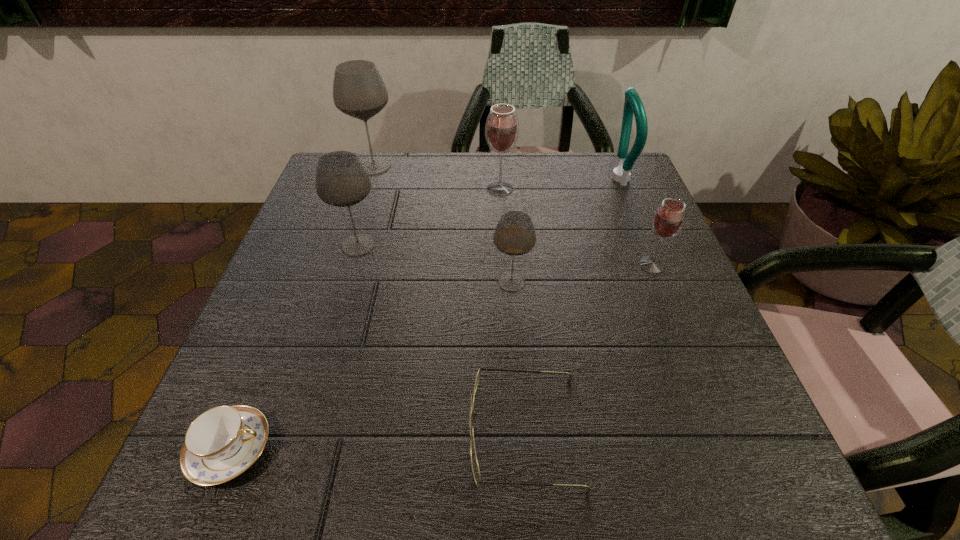
Where is `object positioned at the far left corner`? This screenshot has width=960, height=540. object positioned at the far left corner is located at coordinates (359, 91).

This screenshot has width=960, height=540. Identify the location of object that is positioned at the near left corner. (221, 443).

Identify the location of object that is at the far right corner. This screenshot has height=540, width=960. (633, 104).

Image resolution: width=960 pixels, height=540 pixels. Find the location of `free region at the far edge of the desktop`. free region at the far edge of the desktop is located at coordinates (563, 185).

This screenshot has width=960, height=540. I want to click on free space at the near edge of the desktop, so [413, 488].

In the image, there is a desktop. What are the coordinates of `blank space at the left edge` in the screenshot? It's located at (340, 327).

Where is `free space at the right edge of the desktop`? The height and width of the screenshot is (540, 960). free space at the right edge of the desktop is located at coordinates (676, 416).

Locate an element on the screen. Image resolution: width=960 pixels, height=540 pixels. free spot at the far left corner of the desktop is located at coordinates (378, 179).

Where is `free space at the far right corner of the desktop`? free space at the far right corner of the desktop is located at coordinates (605, 168).

The width and height of the screenshot is (960, 540). Find the location of `unoccupied area between the tallest wineglass and the second smallest gray wineglass`. unoccupied area between the tallest wineglass and the second smallest gray wineglass is located at coordinates (366, 206).